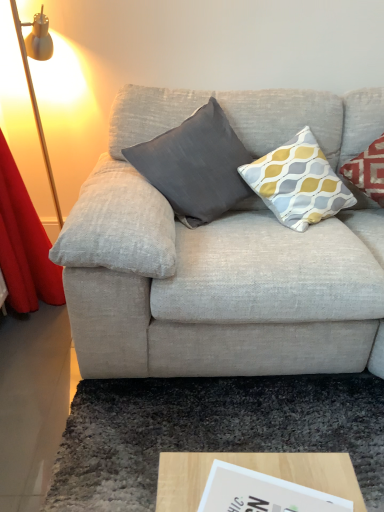
Question: From the image's perspective, relative to yellow-grey-patterned cushion at upper right, which is counted as the 1th pillow, starting from the right, is wooden at lower center above or below?

Choices:
 (A) below
 (B) above

Answer: (A)

Question: Is wooden at lower center taller or shorter than yellow-grey-patterned cushion at upper right, which is counted as the 1th pillow, starting from the right?

Choices:
 (A) short
 (B) tall

Answer: (A)

Question: Which is nearer to the gold metallic floor lamp at left?

Choices:
 (A) dark gray shaggy rug at lower center
 (B) yellow-grey-patterned cushion at upper right, which is counted as the 1th pillow, starting from the right
 (C) dark gray fabric pillow at center, the 1th pillow positioned from the left
 (D) wooden at lower center

Answer: (C)

Question: Considering the real-world distances, which object is farthest from the yellow-grey-patterned cushion at upper right, placed as the second pillow when sorted from left to right?

Choices:
 (A) dark gray fabric pillow at center, the 2th pillow from the right
 (B) wooden at lower center
 (C) gold metallic floor lamp at left
 (D) dark gray shaggy rug at lower center

Answer: (C)